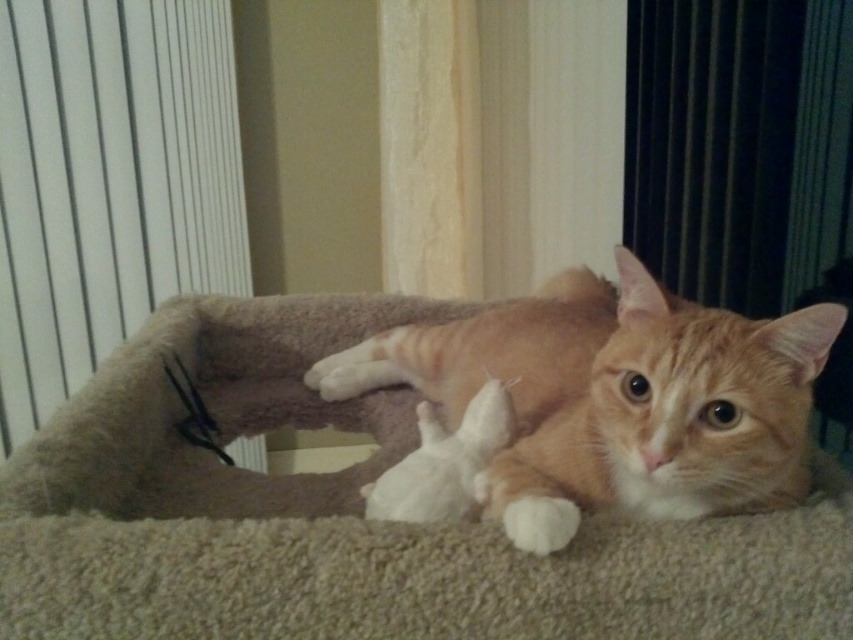
You are trying to decide whether to place a new small toy on the beige plush cat bed at center. Considering the size of the orange fur cat at center, will the bed be large enough to accommodate the cat and the toy comfortably?

The beige plush cat bed at center is bigger than the orange fur cat at center, so there should be enough space for both the cat and the new small toy.

You are a pet owner who wants to ensure your orange fur cat at center has enough space to stretch out comfortably on the beige plush cat bed at center. Based on the scene description, can the cat fit entirely on the bed without any part of its body hanging off?

The beige plush cat bed at center is wider than the orange fur cat at center, so the cat should have enough space to stretch out comfortably without any part of its body hanging off the bed.